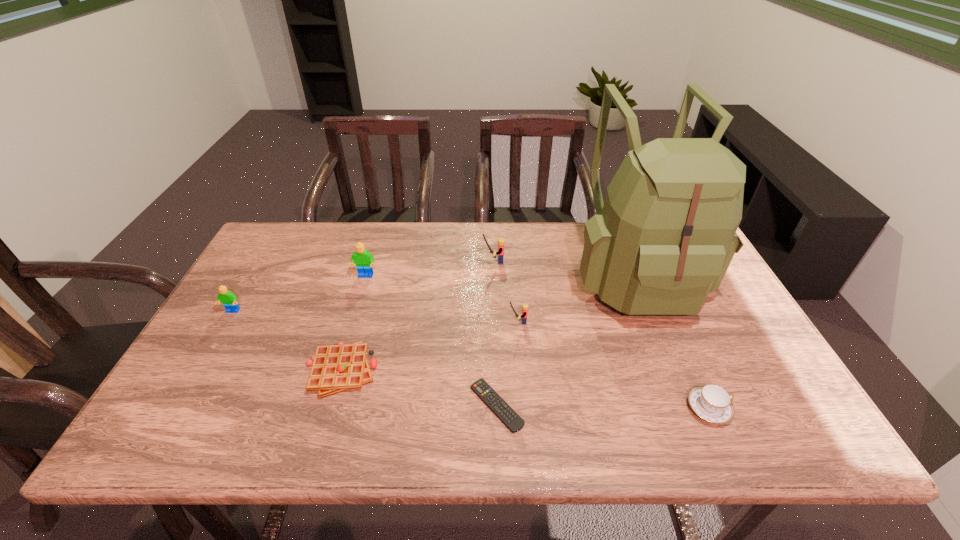
Find the location of a particular element. free spot between the leftmost Lego and the right green Lego is located at coordinates (300, 294).

The image size is (960, 540). I want to click on vacant area that lies between the backpack and the second nearest Lego, so click(434, 293).

The width and height of the screenshot is (960, 540). Identify the location of unoccupied position between the remote control and the bigger green Lego. (431, 341).

Find the location of a particular element. This screenshot has width=960, height=540. free spot between the shortest object and the backpack is located at coordinates (565, 340).

The height and width of the screenshot is (540, 960). Identify the location of unoccupied area between the blue teacup and the green backpack. (672, 341).

The image size is (960, 540). Identify the location of vacant space that is in between the nearer green Lego and the blue teacup. (470, 360).

Where is `vacant region between the farther green Lego and the farthest Lego`? The height and width of the screenshot is (540, 960). vacant region between the farther green Lego and the farthest Lego is located at coordinates (429, 268).

Where is `free space that is in between the teacup and the second shortest object`? The width and height of the screenshot is (960, 540). free space that is in between the teacup and the second shortest object is located at coordinates (525, 389).

Locate an element on the screen. the fifth closest object to the right green Lego is located at coordinates (481, 388).

Choose which object is the nearest neighbor to the second farthest Lego. Please provide its 2D coordinates. Your answer should be formatted as a tuple, i.e. [(x, y)], where the tuple contains the x and y coordinates of a point satisfying the conditions above.

[(335, 368)]